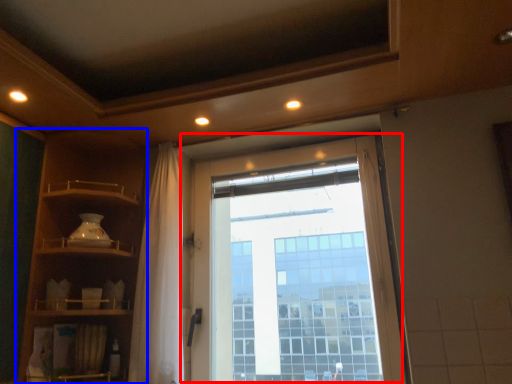
Question: Which object appears farthest to the camera in this image, window (highlighted by a red box) or shelf (highlighted by a blue box)?

Choices:
 (A) window
 (B) shelf

Answer: (A)